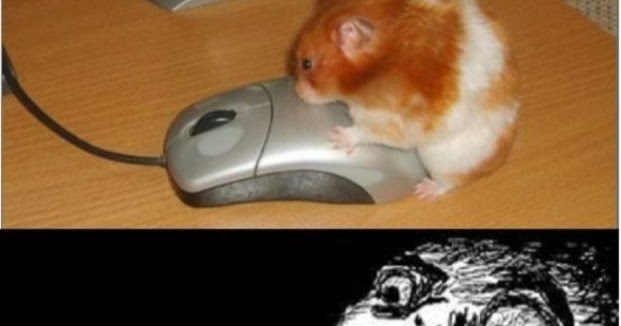
What are the coordinates of `computer mouse` in the screenshot? It's located at (288, 151).